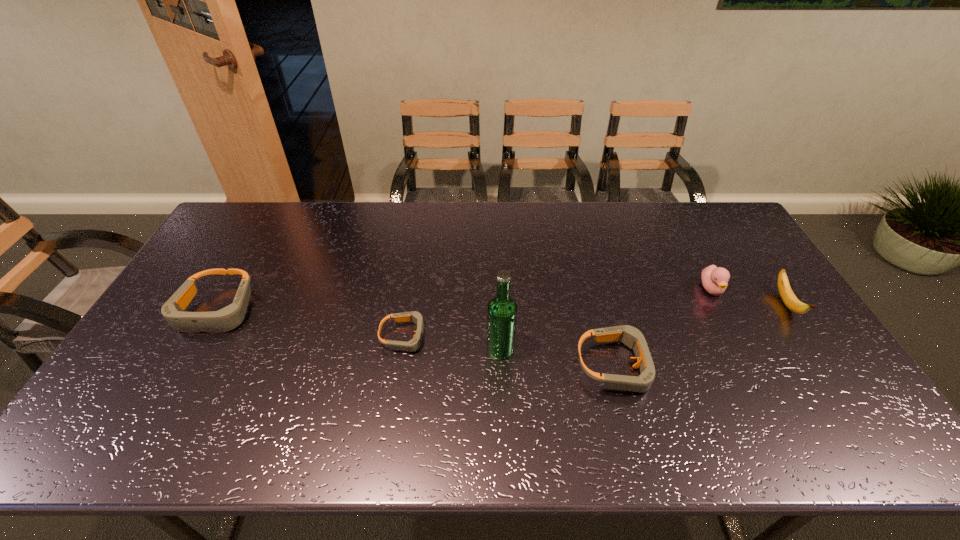
With all goggless evenly spaced, where should an extra goggles be placed on the right to continue the pattern? Please point out a vacant space. Please provide its 2D coordinates. Your answer should be formatted as a tuple, i.e. [(x, y)], where the tuple contains the x and y coordinates of a point satisfying the conditions above.

[(854, 398)]